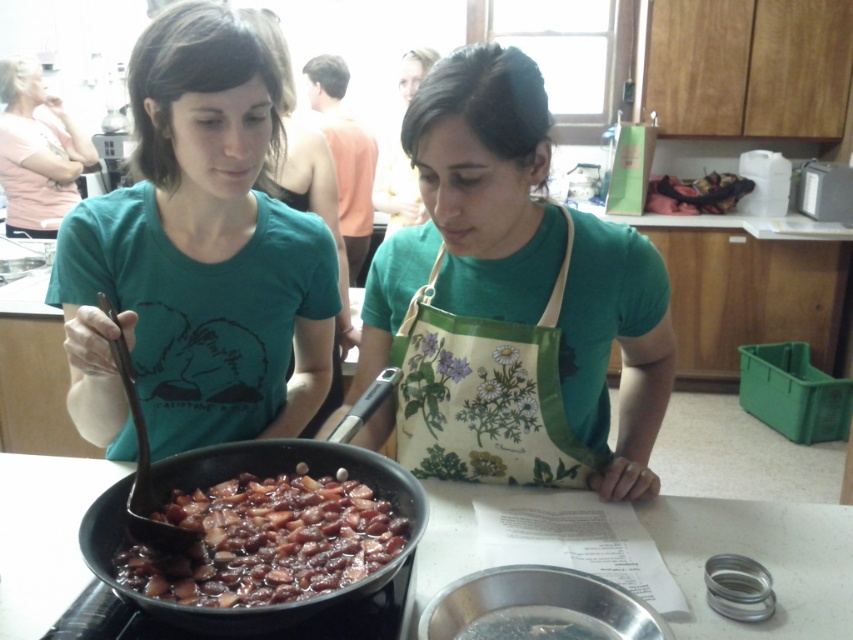
Question: Can you confirm if floral-patterned fabric apron at center is positioned below pink cotton shirt at upper left?

Choices:
 (A) no
 (B) yes

Answer: (B)

Question: Does green matte t-shirt at center appear on the right side of shiny brown beans at center?

Choices:
 (A) yes
 (B) no

Answer: (B)

Question: Among these objects, which one is farthest from the camera?

Choices:
 (A) matte green shirt at upper center
 (B) shiny brown beans at center
 (C) green fabric apron at center
 (D) floral-patterned fabric apron at center

Answer: (A)

Question: Which point is closer to the camera?

Choices:
 (A) orange sleeveless shirt at upper center
 (B) shiny brown beans at center
 (C) floral-patterned fabric apron at center

Answer: (B)

Question: Is floral-patterned fabric apron at center smaller than matte green shirt at upper center?

Choices:
 (A) yes
 (B) no

Answer: (A)

Question: Which object appears closest to the camera in this image?

Choices:
 (A) green matte t-shirt at center
 (B) floral-patterned fabric apron at center
 (C) matte green shirt at upper center
 (D) green fabric apron at center

Answer: (A)